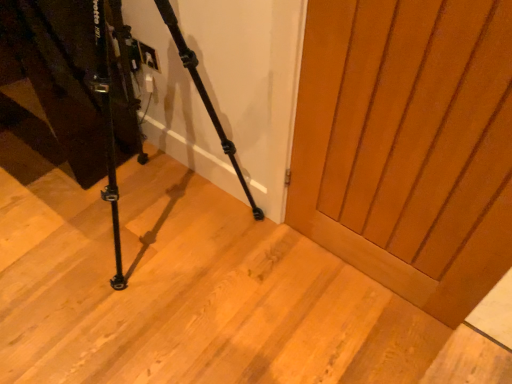
I want to click on free space to the left of matte wood door at center, so click(x=261, y=282).